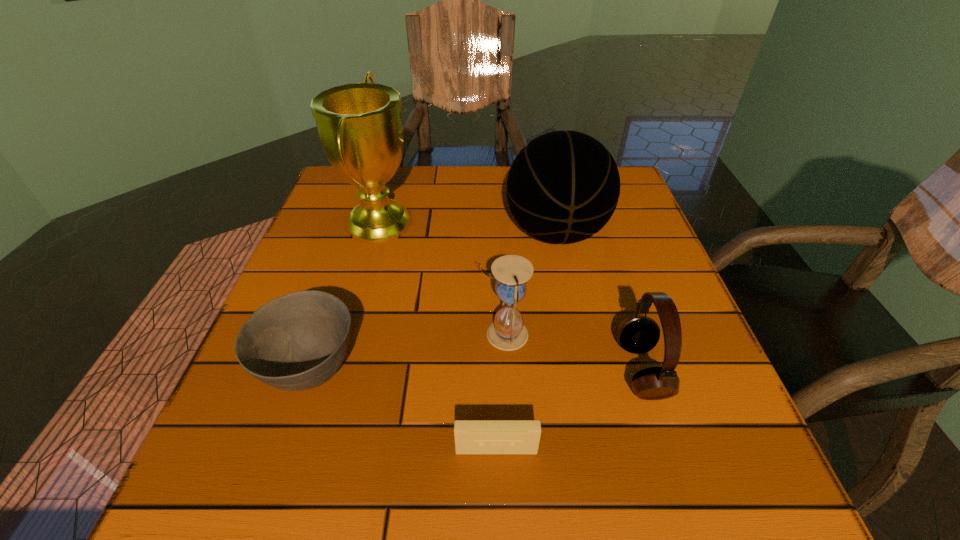
The image size is (960, 540). In order to click on free space between the basketball and the hourglass in this screenshot , I will do `click(530, 284)`.

At what (x,y) coordinates should I click in order to perform the action: click on empty space that is in between the headset and the basketball. Please return your answer as a coordinate pair (x, y). The width and height of the screenshot is (960, 540). Looking at the image, I should click on (599, 302).

At what (x,y) coordinates should I click in order to perform the action: click on vacant area that lies between the videotape and the tallest object. Please return your answer as a coordinate pair (x, y). Looking at the image, I should click on (438, 336).

The image size is (960, 540). What are the coordinates of `empty space that is in between the second tallest object and the award` in the screenshot? It's located at (468, 227).

Locate an element on the screen. vacant space that's between the nearest object and the award is located at coordinates (438, 336).

You are a GUI agent. You are given a task and a screenshot of the screen. Output one action in this format:
    pyautogui.click(x=<x>, y=<y>)
    Task: Click on the free space between the third shortest object and the shortest object
    
    Given the screenshot: What is the action you would take?
    pyautogui.click(x=569, y=410)

At what (x,y) coordinates should I click in order to perform the action: click on empty space that is in between the award and the hourglass. Please return your answer as a coordinate pair (x, y). The height and width of the screenshot is (540, 960). Looking at the image, I should click on (442, 278).

Find the location of `blank region between the tallest object and the fifth shortest object`. blank region between the tallest object and the fifth shortest object is located at coordinates (468, 227).

Find the location of a particular element. The image size is (960, 540). object that can be found as the third closest to the headset is located at coordinates (563, 187).

Identify which object is the third nearest to the fifth shortest object. Please provide its 2D coordinates. Your answer should be formatted as a tuple, i.e. [(x, y)], where the tuple contains the x and y coordinates of a point satisfying the conditions above.

[(360, 127)]